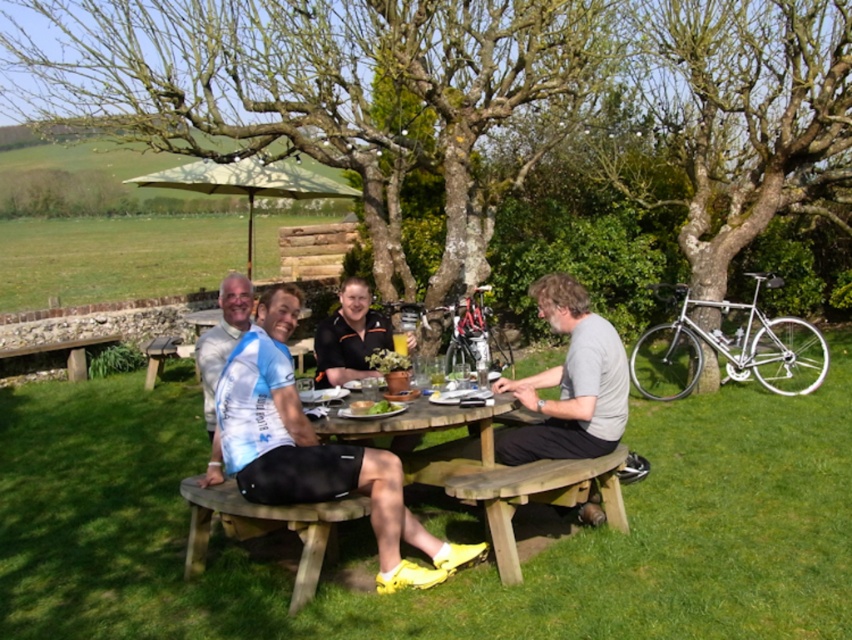
Question: Among these points, which one is nearest to the camera?

Choices:
 (A) 499,560
 (B) 491,456
 (C) 366,412

Answer: (A)

Question: Which point is farther to the camera?

Choices:
 (A) (383, 435)
 (B) (588, 477)

Answer: (B)

Question: Which point appears closest to the camera in this image?

Choices:
 (A) (570, 460)
 (B) (574, 294)
 (C) (239, 291)

Answer: (A)

Question: Is blue and white cycling jersey at center above wooden bench at lower center?

Choices:
 (A) yes
 (B) no

Answer: (A)

Question: Is wooden bench at lower center thinner than light blue jersey at center?

Choices:
 (A) no
 (B) yes

Answer: (A)

Question: Does smooth bark tree at right have a greater width compared to wooden bench at lower center?

Choices:
 (A) yes
 (B) no

Answer: (A)